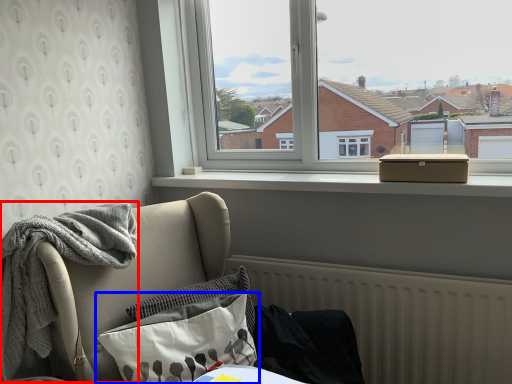
Question: Among these objects, which one is nearest to the camera, material (highlighted by a red box) or pillow (highlighted by a blue box)?

Choices:
 (A) material
 (B) pillow

Answer: (A)